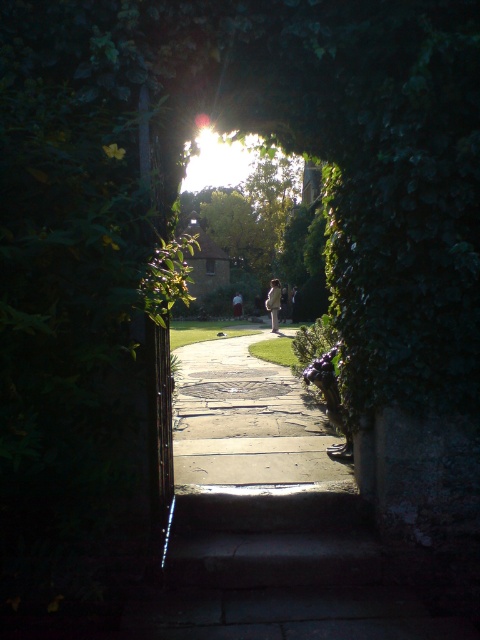
You are standing in the garden and want to walk to the small building with the red tiled roof. You see the smooth concrete path at center and the light beige coat at center. Which object is closer to you?

The smooth concrete path at center is closer to the viewer than the light beige coat at center, so the smooth concrete path at center is closer to you.

You are standing in the garden and see the smooth concrete path at center and the light beige coat at center. Which object is closer to the ground?

The smooth concrete path at center is located below the light beige coat at center, so it is closer to the ground.

You are a photographer standing at the stone archway entrance. You want to capture a photo of the smooth concrete path at center and the light beige coat at center. Which object will appear taller in the photo?

The light beige coat at center will appear taller in the photo because it is taller than the smooth concrete path at center according to the description.